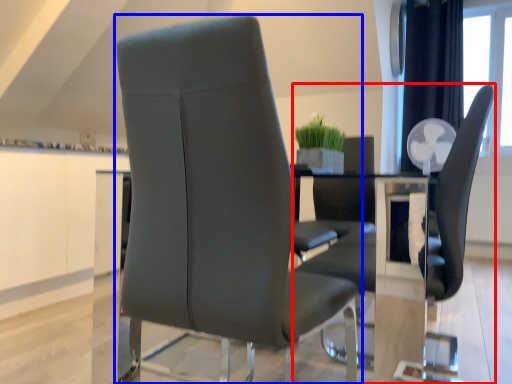
Question: Among these objects, which one is nearest to the camera, chair (highlighted by a red box) or chair (highlighted by a blue box)?

Choices:
 (A) chair
 (B) chair

Answer: (B)